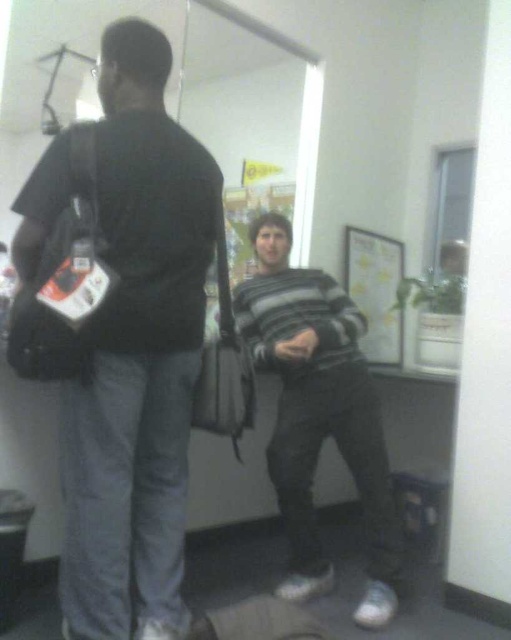
Question: Which object is farther from the camera taking this photo?

Choices:
 (A) black matte bag at left
 (B) striped sweater at center

Answer: (B)

Question: Is black matte bag at left further to camera compared to striped sweater at center?

Choices:
 (A) yes
 (B) no

Answer: (B)

Question: Does black matte bag at left appear on the left side of striped sweater at center?

Choices:
 (A) yes
 (B) no

Answer: (A)

Question: Is black matte bag at left below striped sweater at center?

Choices:
 (A) no
 (B) yes

Answer: (A)